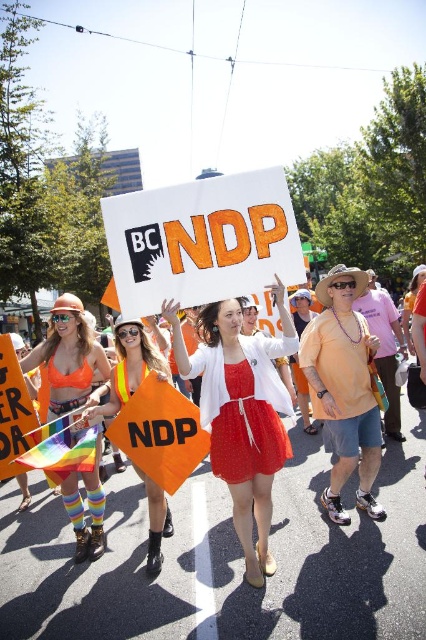
Question: Can you confirm if orange fabric sign at center is thinner than white paper sign at center?

Choices:
 (A) yes
 (B) no

Answer: (B)

Question: Does orange fabric sign at center have a smaller size compared to matte red dress at center?

Choices:
 (A) yes
 (B) no

Answer: (B)

Question: Which of the following is the closest to the observer?

Choices:
 (A) white paper sign at center
 (B) neon orange fabric at center
 (C) matte white dress at center

Answer: (C)

Question: Estimate the real-world distances between objects in this image. Which object is closer to the neon orange safety vest at center?

Choices:
 (A) white paper sign at center
 (B) matte red dress at center

Answer: (B)

Question: Which of the following is the closest to the observer?

Choices:
 (A) (51, 324)
 (B) (160, 509)
 (C) (241, 461)
 (D) (273, 442)

Answer: (C)

Question: Considering the relative positions of white paper sign at center and neon orange fabric at center in the image provided, where is white paper sign at center located with respect to neon orange fabric at center?

Choices:
 (A) above
 (B) below

Answer: (A)